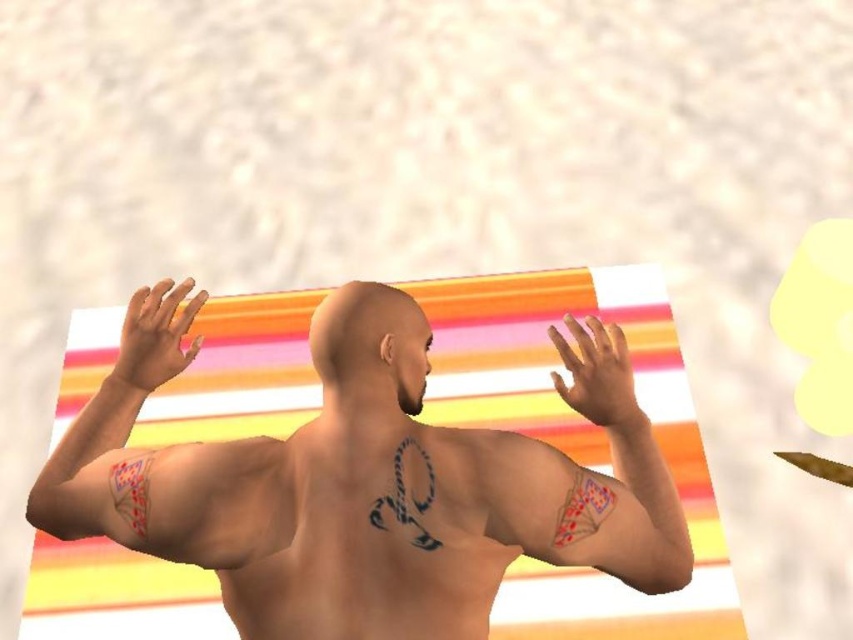
Question: Estimate the real-world distances between objects in this image. Which object is farther from the smooth skin tattoo at left?

Choices:
 (A) smooth skin hand at left
 (B) smooth skin man at center

Answer: (B)

Question: In this image, where is smooth skin hand at center located relative to smooth skin hand at left?

Choices:
 (A) above
 (B) below

Answer: (B)

Question: Is smooth skin man at center in front of smooth skin hand at left?

Choices:
 (A) yes
 (B) no

Answer: (A)

Question: Which object appears closest to the camera in this image?

Choices:
 (A) smooth skin tattoo at center
 (B) smooth skin hand at left

Answer: (A)

Question: Does smooth skin man at center have a lesser width compared to smooth skin hand at center?

Choices:
 (A) yes
 (B) no

Answer: (B)

Question: Which point is closer to the camera?

Choices:
 (A) (149, 294)
 (B) (585, 317)
 (C) (631, 470)

Answer: (C)